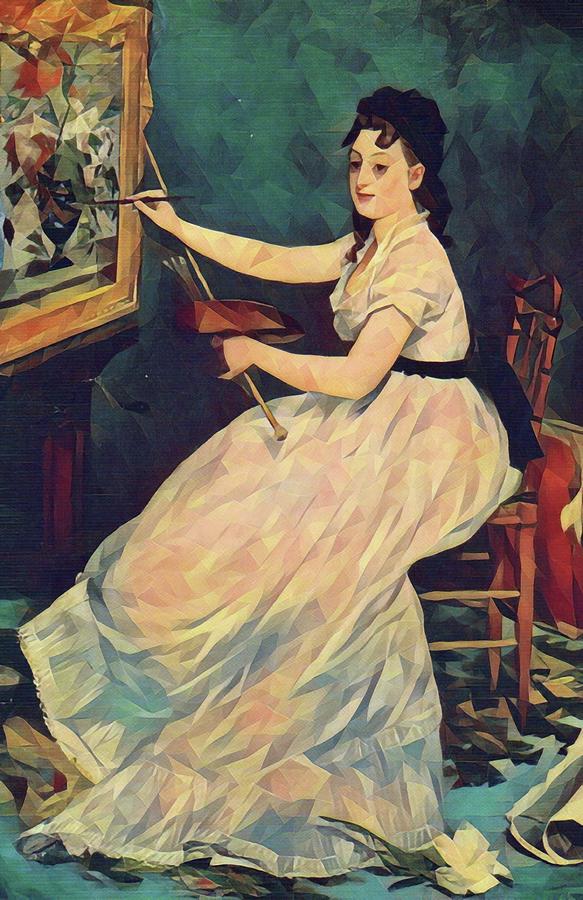
Find the location of a particular element. chair back is located at coordinates (538, 300).